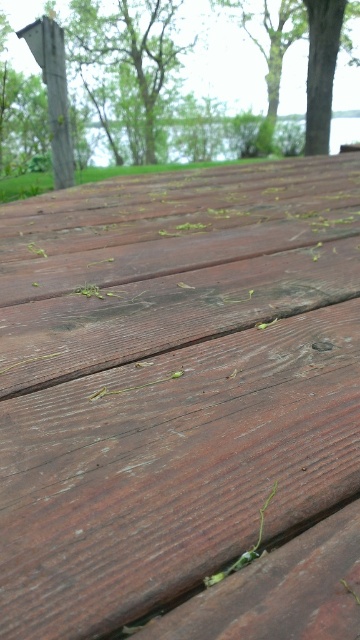
Question: Does green leafy tree at upper left appear under green leafy tree at upper center?

Choices:
 (A) no
 (B) yes

Answer: (B)

Question: Which is farther from the smooth gray post at upper left?

Choices:
 (A) dark brown wood at center
 (B) green leafy tree at upper left
 (C) green leafy tree at upper center

Answer: (A)

Question: Is dark brown wood at center to the left of green leafy tree at upper left from the viewer's perspective?

Choices:
 (A) no
 (B) yes

Answer: (A)

Question: Does green leafy tree at upper left appear under smooth gray post at upper left?

Choices:
 (A) yes
 (B) no

Answer: (A)

Question: Which object is positioned closest to the smooth gray post at upper left?

Choices:
 (A) green leafy tree at upper left
 (B) dark brown wood at center
 (C) green leafy tree at upper center

Answer: (C)

Question: Which point appears farthest from the camera in this image?

Choices:
 (A) (189, 321)
 (B) (231, 4)
 (C) (109, 56)

Answer: (C)